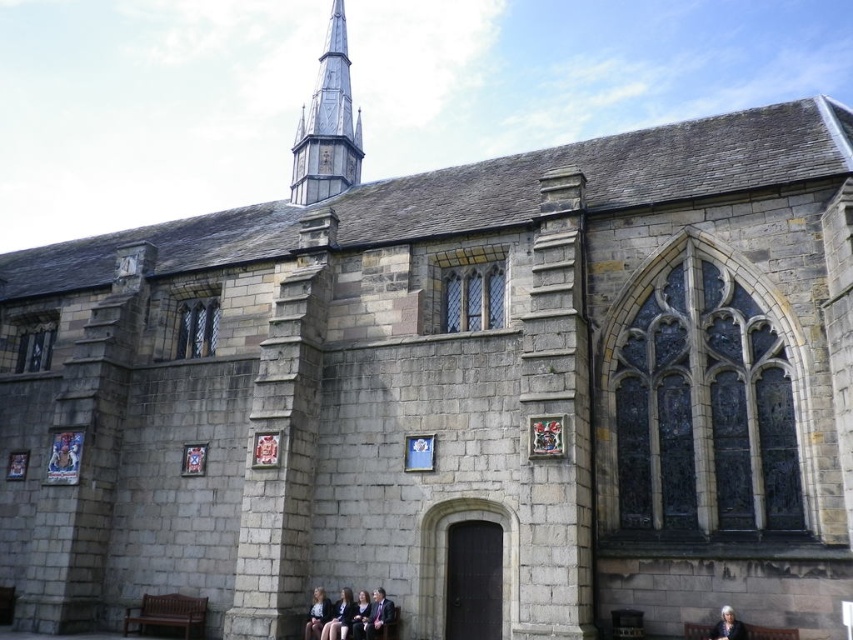
You are standing in front of the historic stone building and want to determine the relative positions of two points marked on the structure. The first point is located at coordinates point (711, 630) and the second at point (383, 602). Which point is closer to you?

Point (711, 630) is closer to the viewer than point (383, 602).

You are standing in front of the historic stone building and want to locate the gray stone spire at upper center. According to the coordinates provided, where exactly would you look to find it?

The gray stone spire at upper center is located at point coordinates of 0.197 on the x axis and 0.385 on the y axis.

You are standing in front of the historic stone building and see a brown wooden park bench at lower center and a formal suit at lower center. Which object is positioned higher from the ground?

The brown wooden park bench at lower center is located above the formal suit at lower center, so it is positioned higher from the ground.